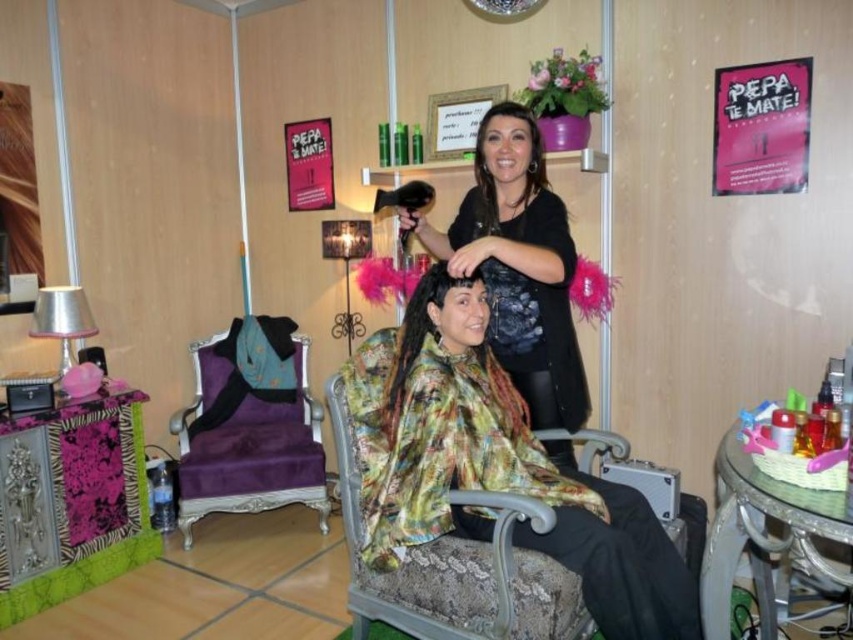
You are a customer entering the hair salon and see the floral silk robe at center and the purple velvet chair at left. Which object is located to the right of the other?

The floral silk robe at center is positioned on the right side of purple velvet chair at left.

You are a customer entering the salon and need to choose between the floral silk robe at center and the purple velvet chair at left. Which item is closer to you when you first walk in?

The floral silk robe at center is closer to the viewer than the purple velvet chair at left, so the floral silk robe at center would be closer when you first walk in.